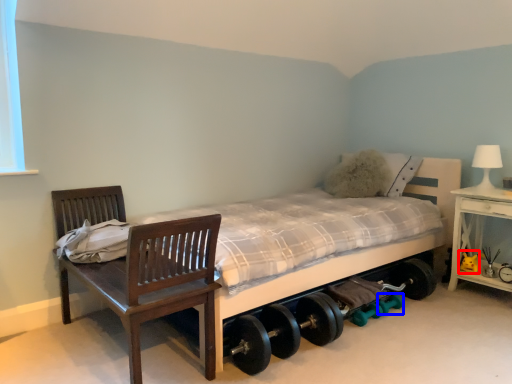
Question: Which of the following is the closest to the observer, toy (highlighted by a red box) or dumbbell (highlighted by a blue box)?

Choices:
 (A) toy
 (B) dumbbell

Answer: (B)